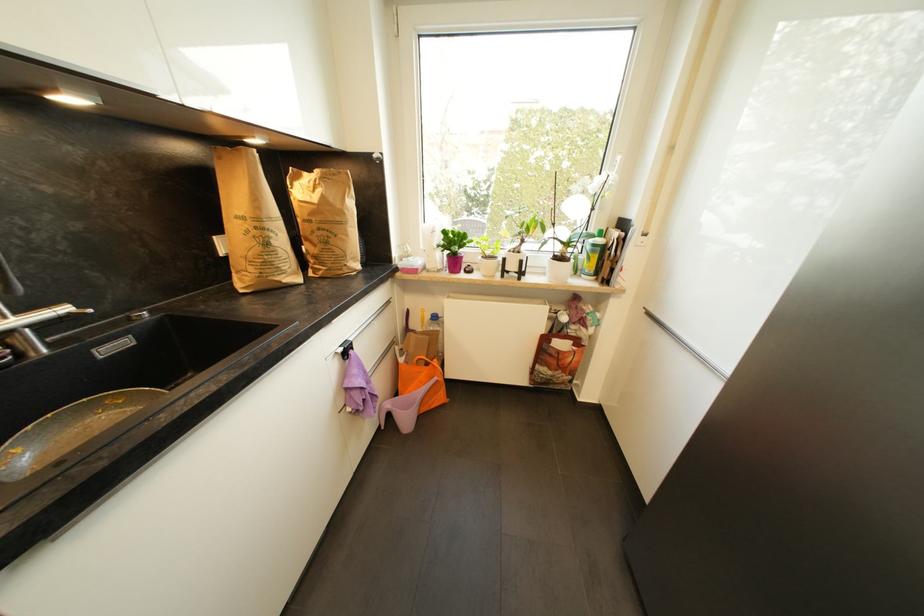
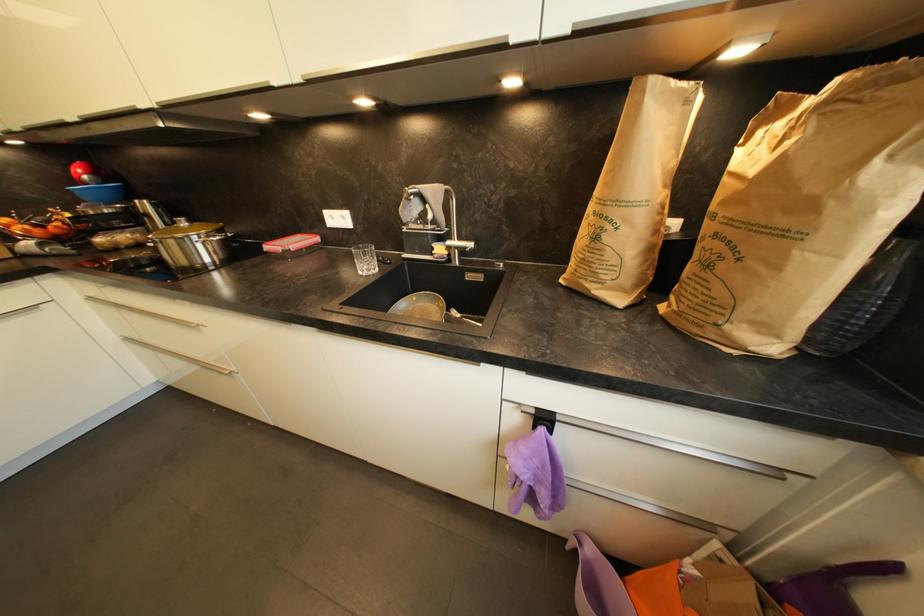
First-person continuous shooting, in which direction is the camera rotating?

The rotation direction of the camera is left-down.